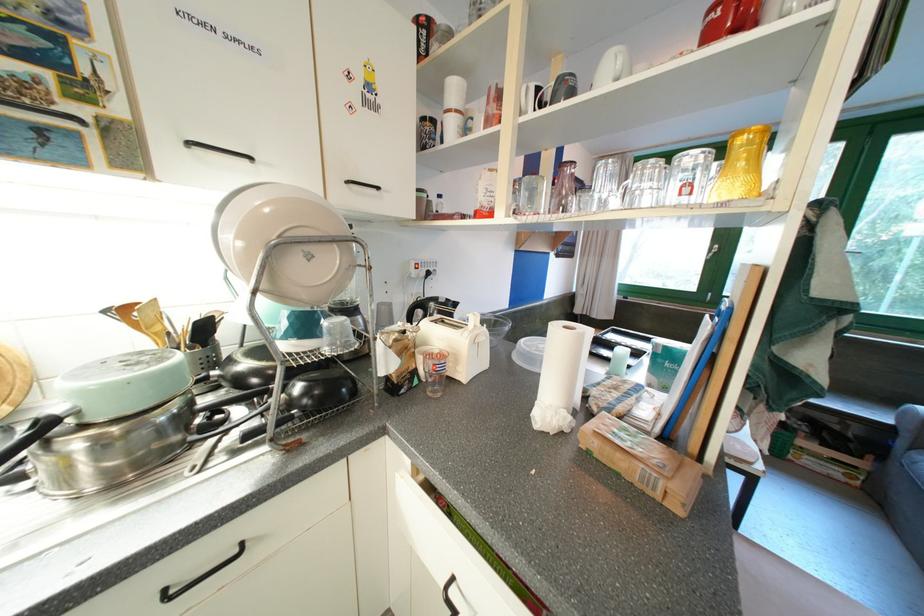
The image size is (924, 616). In order to click on black drawer handle in this screenshot , I will do `click(200, 576)`.